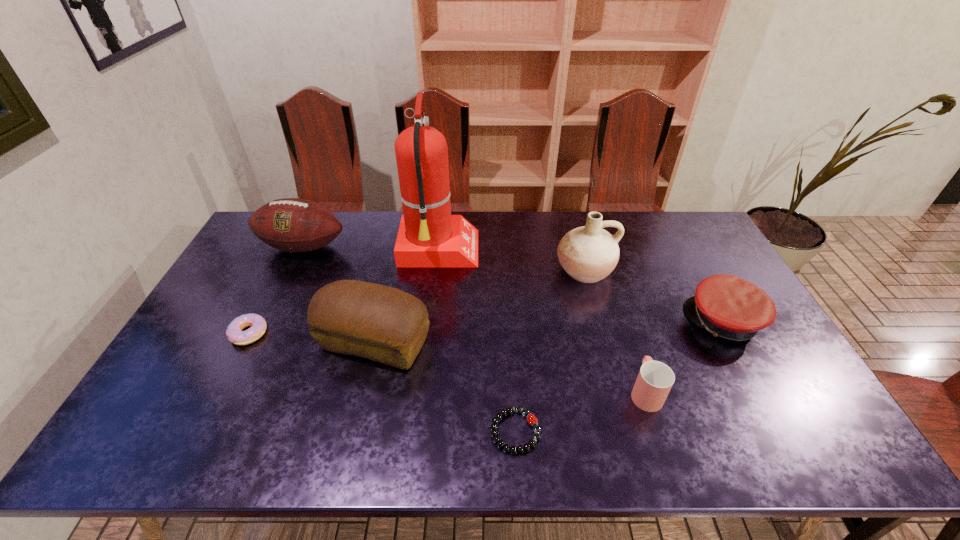
Identify the location of free space located 0.120m to pour from the handle of the pottery. The image size is (960, 540). (597, 319).

Locate an element on the screen. The height and width of the screenshot is (540, 960). vacant space positioned 0.120m on the back of the football (American) is located at coordinates (319, 213).

Locate an element on the screen. Image resolution: width=960 pixels, height=540 pixels. free space located on the back of the bread is located at coordinates (394, 261).

Find the location of a particular element. vacant area located on the front-facing side of the rightmost object is located at coordinates (559, 322).

You are a GUI agent. You are given a task and a screenshot of the screen. Output one action in this format:
    pyautogui.click(x=<x>, y=<y>)
    Task: Click on the free location located 0.300m on the front-facing side of the rightmost object
    Image resolution: width=960 pixels, height=540 pixels.
    Given the screenshot: What is the action you would take?
    pyautogui.click(x=586, y=322)

Identify the location of free space located on the front-facing side of the rightmost object. (599, 322).

This screenshot has height=540, width=960. Identify the location of free point located 0.090m on the side of the cup with the handle. (631, 346).

In order to click on vacant region located 0.160m on the side of the cup with the handle in this screenshot , I will do `click(624, 327)`.

The height and width of the screenshot is (540, 960). Identify the location of vacant point located 0.190m on the side of the cup with the handle. (622, 320).

Identify the location of free space located on the right of the doughnut. (394, 334).